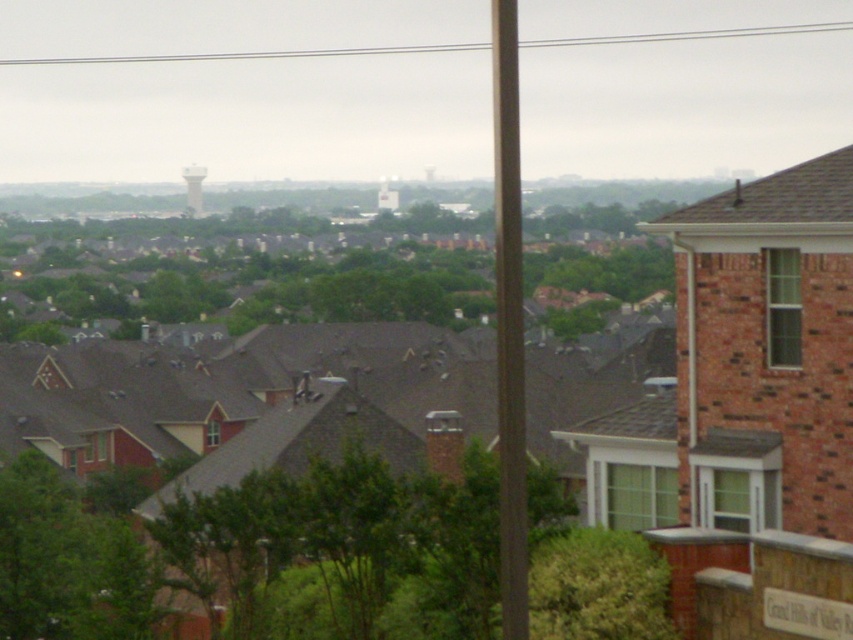
Question: Is the position of brown wood pole at center less distant than that of white concrete water tower at center?

Choices:
 (A) yes
 (B) no

Answer: (A)

Question: Among these points, which one is nearest to the camera?

Choices:
 (A) (500, 58)
 (B) (189, 176)

Answer: (A)

Question: Does brown wood pole at center have a smaller size compared to white matte water tower at upper left?

Choices:
 (A) yes
 (B) no

Answer: (B)

Question: Is brown wood pole at center further to camera compared to white concrete water tower at center?

Choices:
 (A) yes
 (B) no

Answer: (B)

Question: Among these objects, which one is nearest to the camera?

Choices:
 (A) white matte water tower at upper left
 (B) white concrete water tower at center

Answer: (A)

Question: Which object is farther from the camera taking this photo?

Choices:
 (A) white matte water tower at upper left
 (B) white concrete water tower at center
 (C) brown wood pole at center

Answer: (B)